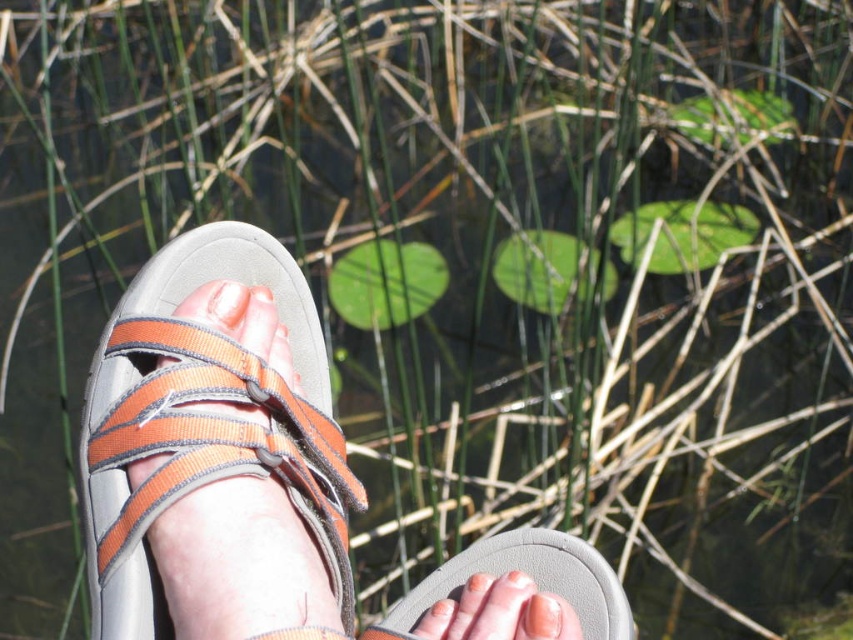
Question: Which of the following is the closest to the observer?

Choices:
 (A) orange fabric sandal at left
 (B) pink flesh at center
 (C) gray rubber sandal at lower center
 (D) matte orange nail at lower center

Answer: (A)

Question: Which object is the closest to the matte orange nail at lower center?

Choices:
 (A) orange fabric sandal at left
 (B) gray rubber sandal at lower center
 (C) pink flesh at center

Answer: (B)

Question: Can you confirm if orange fabric sandal at left is positioned above gray rubber sandal at lower center?

Choices:
 (A) no
 (B) yes

Answer: (B)

Question: Observing the image, what is the correct spatial positioning of matte orange nail at lower center in reference to pink flesh at center?

Choices:
 (A) left
 (B) right

Answer: (B)

Question: Which object is positioned farthest from the pink flesh at center?

Choices:
 (A) matte orange nail at lower center
 (B) orange fabric sandal at left

Answer: (A)

Question: Can you confirm if orange fabric sandal at left is smaller than gray rubber sandal at lower center?

Choices:
 (A) yes
 (B) no

Answer: (B)